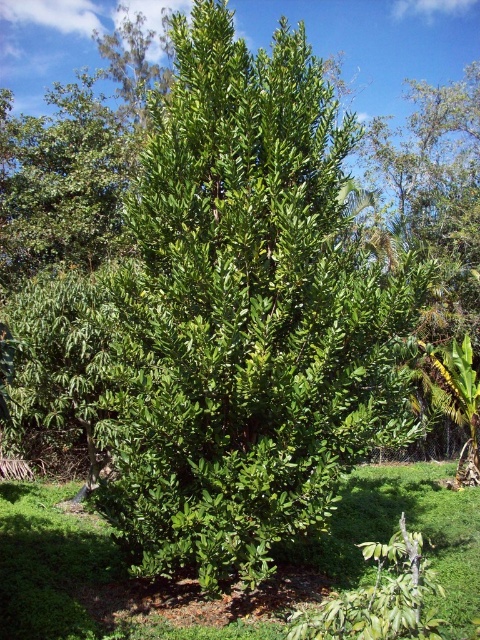
The height and width of the screenshot is (640, 480). What do you see at coordinates (244, 314) in the screenshot?
I see `green leafy bush at center` at bounding box center [244, 314].

Does green leafy bush at center have a smaller size compared to green leafy grass at center?

Indeed, green leafy bush at center has a smaller size compared to green leafy grass at center.

Is point (159, 392) closer to camera compared to point (41, 484)?

Yes, point (159, 392) is in front of point (41, 484).

This screenshot has height=640, width=480. What are the coordinates of `green leafy bush at center` in the screenshot? It's located at (244, 314).

Between point (24, 584) and point (29, 236), which one is positioned behind?

Positioned behind is point (29, 236).

Is green leafy grass at center shorter than green leafy tree at upper left?

No.

You are a GUI agent. You are given a task and a screenshot of the screen. Output one action in this format:
    pyautogui.click(x=<x>, y=<y>)
    Task: Click on the green leafy grass at center
    Image resolution: width=480 pixels, height=640 pixels.
    Given the screenshot: What is the action you would take?
    pyautogui.click(x=196, y=584)

How distant is green leafy bush at center from green leafy tree at upper left?

green leafy bush at center and green leafy tree at upper left are 11.21 meters apart.

How much distance is there between green leafy bush at center and green leafy tree at upper left?

11.21 meters

Is point (275, 400) less distant than point (120, 196)?

Yes, it is.

At what (x,y) coordinates should I click in order to perform the action: click on green leafy bush at center. Please return your answer as a coordinate pair (x, y). This screenshot has height=640, width=480. Looking at the image, I should click on (244, 314).